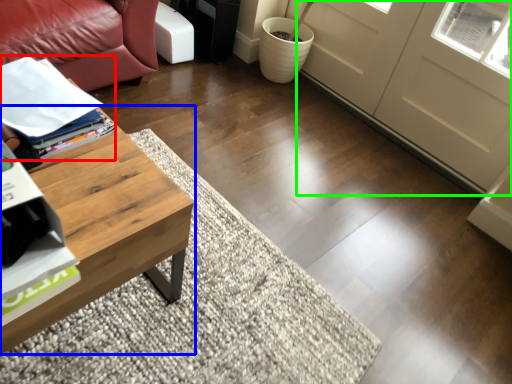
Question: Based on their relative distances, which object is farther from magazine (highlighted by a red box)? Choose from coffee table (highlighted by a blue box) and screen door (highlighted by a green box).

Choices:
 (A) coffee table
 (B) screen door

Answer: (B)